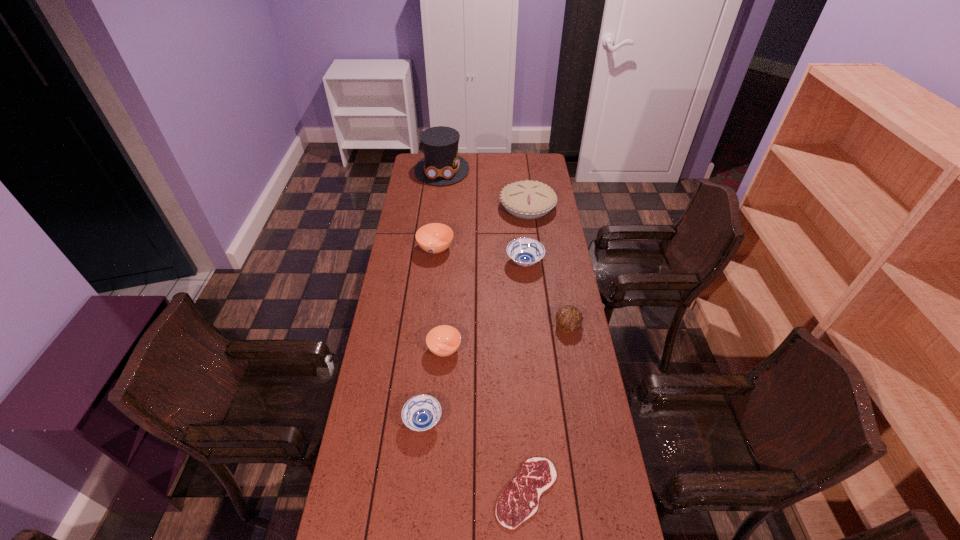
What are the coordinates of `dress hat` in the screenshot? It's located at (441, 165).

In order to click on the tallest object in this screenshot , I will do `click(441, 165)`.

The image size is (960, 540). I want to click on the second farthest object, so click(526, 199).

Find the location of a particular element. The width and height of the screenshot is (960, 540). pie is located at coordinates (526, 199).

At what (x,y) coordinates should I click in order to perform the action: click on the bigger peach soup bowl. Please return your answer as a coordinate pair (x, y). This screenshot has width=960, height=540. Looking at the image, I should click on (434, 238).

Find the location of a particular element. the farther blue soup bowl is located at coordinates (525, 252).

The image size is (960, 540). Identify the location of the bigger blue soup bowl. (525, 252).

The width and height of the screenshot is (960, 540). I want to click on muffin, so click(x=568, y=318).

The height and width of the screenshot is (540, 960). What are the coordinates of `the third farthest soup bowl` in the screenshot? It's located at (444, 340).

The height and width of the screenshot is (540, 960). I want to click on the smaller peach soup bowl, so click(444, 340).